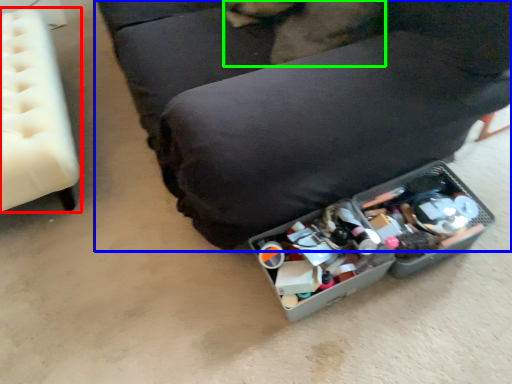
Question: Which object is positioned closest to furniture (highlighted by a red box)? Select from furniture (highlighted by a blue box) and animal (highlighted by a green box).

Choices:
 (A) furniture
 (B) animal

Answer: (A)